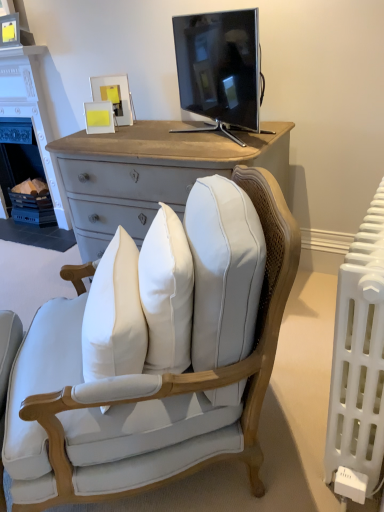
Question: Considering the positions of point click(354, 470) and point click(198, 28), is point click(354, 470) closer or farther from the camera than point click(198, 28)?

Choices:
 (A) closer
 (B) farther

Answer: (A)

Question: Would you say white plastic radiator at right is to the left or to the right of black glossy tv at upper center in the picture?

Choices:
 (A) left
 (B) right

Answer: (B)

Question: Which object is positioned farthest from the white painted wood fireplace at left?

Choices:
 (A) black glossy tv at upper center
 (B) white plastic radiator at right
 (C) light blue fabric chair at center

Answer: (B)

Question: Estimate the real-world distances between objects in this image. Which object is closer to the black glossy tv at upper center?

Choices:
 (A) white painted wood fireplace at left
 (B) light blue fabric chair at center
 (C) white plastic radiator at right

Answer: (B)